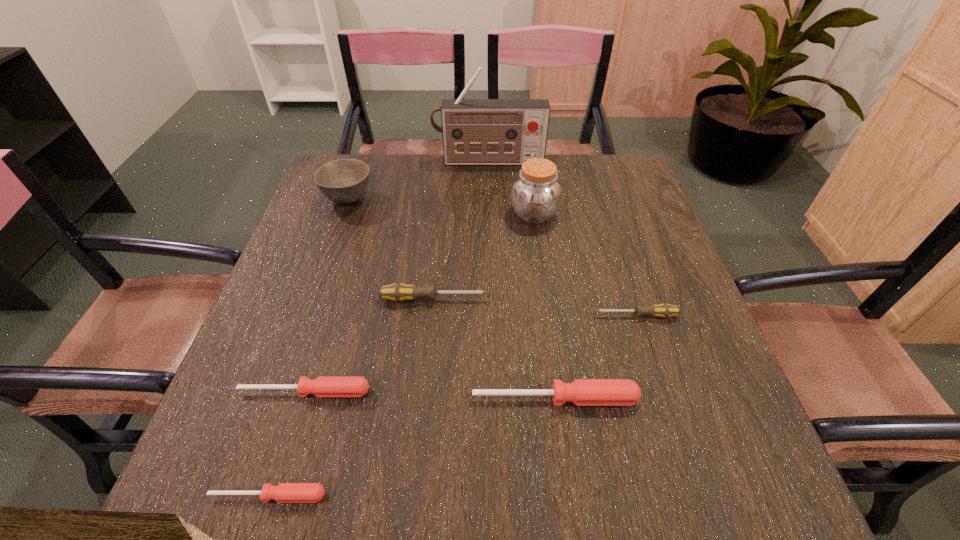
Where is `screwdriver that is the second closest to the shortest object`? screwdriver that is the second closest to the shortest object is located at coordinates (582, 392).

What are the coordinates of `red screwdriver that can be found as the second closest to the second smallest red screwdriver` in the screenshot? It's located at (582, 392).

In order to click on red screwdriver that stands as the closest to the fifth nearest object in this screenshot , I will do `click(323, 386)`.

Locate an element on the screen. This screenshot has width=960, height=540. free space that satisfies the following two spatial constraints: 1. on the front panel of the seventh shortest object; 2. on the right side of the tallest object is located at coordinates (490, 214).

This screenshot has height=540, width=960. In order to click on free spot that satisfies the following two spatial constraints: 1. on the front panel of the rightmost red screwdriver; 2. on the right side of the farthest object in this screenshot , I will do `click(494, 399)`.